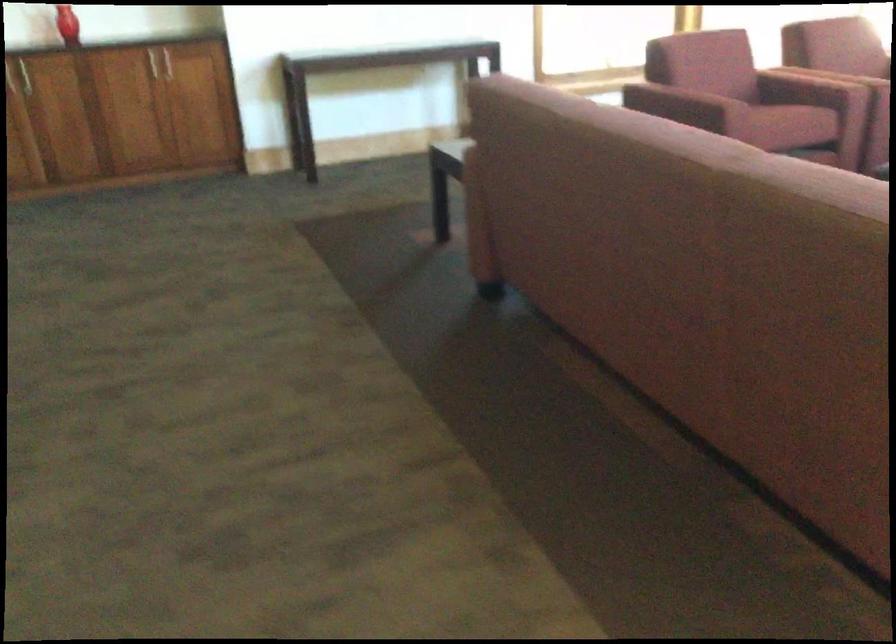
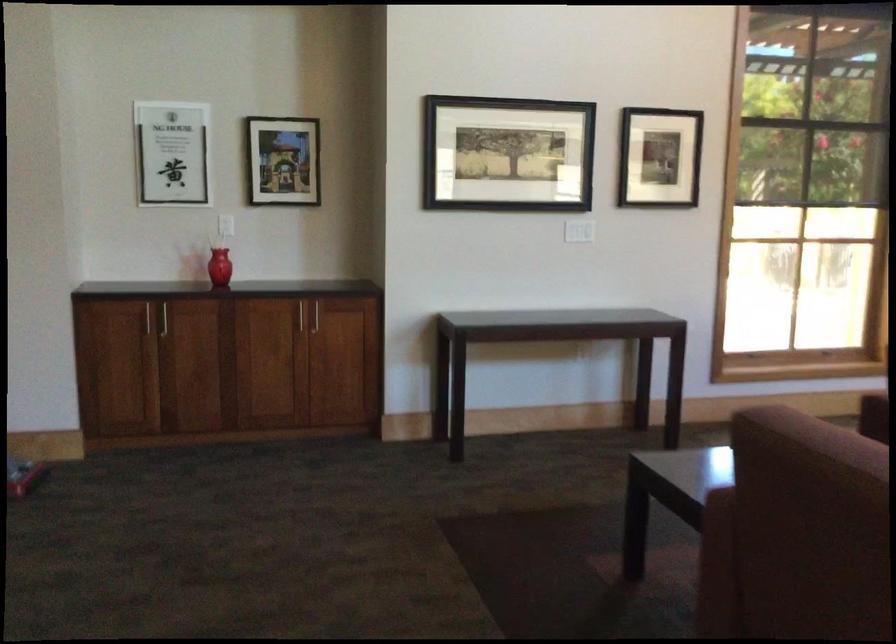
What movement of the cameraman would produce the second image?

The cameraman walked toward left, forward.